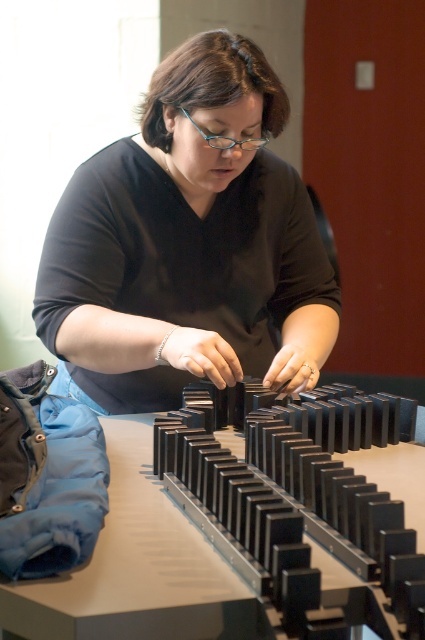
You are a photographer trying to capture a clear shot of the black plastic blocks at center without the matte black shirt at center blocking the view. Based on their positions, can you determine if the shirt is wider than the blocks?

The matte black shirt at center might be wider than black plastic blocks at center, so there is a possibility that the shirt could block the view of the blocks depending on their exact positions.

You are a delivery person who needs to place a small package between the matte black shirt at center and the black plastic blocks at center on the table. The package is 16 inches long. Can you fit it between them without moving either object?

The matte black shirt at center and black plastic blocks at center are 16.01 inches apart. Since the package is 16 inches long, it can fit between them as there is enough space.

You are a photographer trying to capture the scene of the person arranging dominoes. You need to ensure that the matte black shirt at center and the black plastic blocks at center are both clearly visible in the photo. Based on their positions, which object should you focus on first to ensure both are in focus?

The matte black shirt at center is taller than the black plastic blocks at center, so you should focus on the matte black shirt at center first to ensure both are in focus.